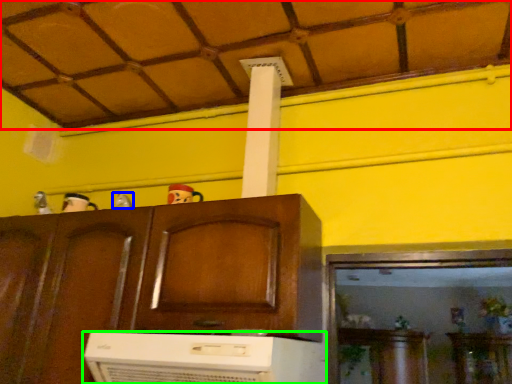
Question: Which object is the closest to the tile roof (highlighted by a red box)? Choose among these: toy (highlighted by a blue box) or home appliance (highlighted by a green box).

Choices:
 (A) toy
 (B) home appliance

Answer: (A)